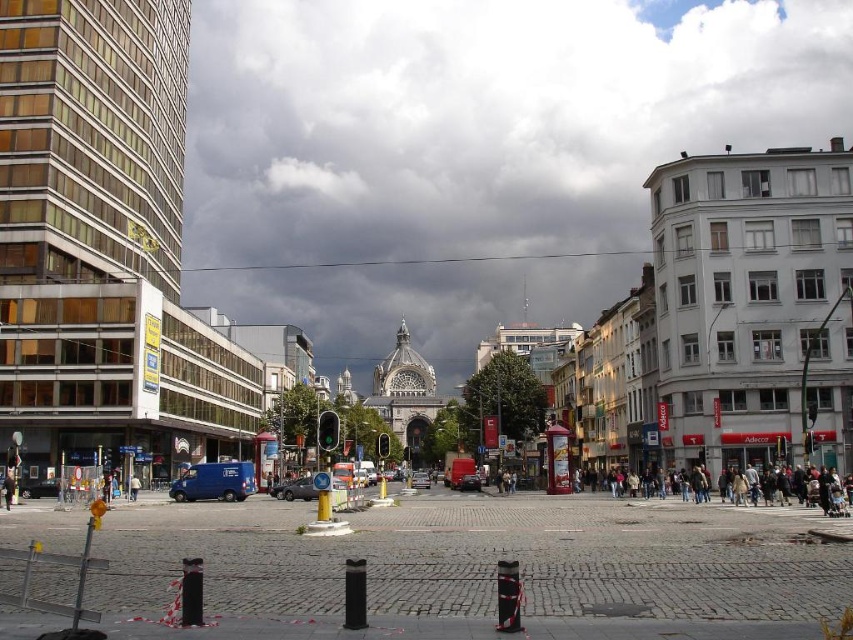
Is the position of shiny silver car at center more distant than that of metallic silver car at center?

No, it is in front of metallic silver car at center.

Between point (279, 497) and point (418, 472), which one is positioned behind?

The point (418, 472) is behind.

I want to click on shiny silver car at center, so click(297, 490).

Can you confirm if cloudy sky at center is shorter than shiny silver car at center?

No, cloudy sky at center is not shorter than shiny silver car at center.

Can you confirm if cloudy sky at center is smaller than shiny silver car at center?

Actually, cloudy sky at center might be larger than shiny silver car at center.

Where is `cloudy sky at center`? cloudy sky at center is located at coordinates (469, 150).

You are a GUI agent. You are given a task and a screenshot of the screen. Output one action in this format:
    pyautogui.click(x=<x>, y=<y>)
    Task: Click on the cloudy sky at center
    This screenshot has width=853, height=640.
    Given the screenshot: What is the action you would take?
    pyautogui.click(x=469, y=150)

Who is shorter, cloudy sky at center or metallic silver car at center?

With less height is metallic silver car at center.

Is cloudy sky at center taller than metallic silver car at center?

Correct, cloudy sky at center is much taller as metallic silver car at center.

The image size is (853, 640). What do you see at coordinates (469, 150) in the screenshot?
I see `cloudy sky at center` at bounding box center [469, 150].

The height and width of the screenshot is (640, 853). In order to click on cloudy sky at center in this screenshot , I will do `click(469, 150)`.